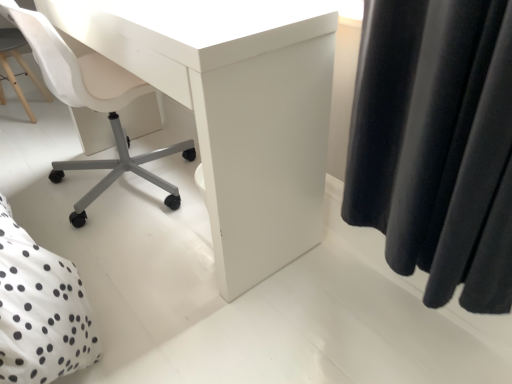
Question: Should I look upward or downward to see white plastic chair at lower left?

Choices:
 (A) up
 (B) down

Answer: (A)

Question: Should I look upward or downward to see white matte desk at center?

Choices:
 (A) down
 (B) up

Answer: (B)

Question: Can you confirm if white plastic chair at lower left is wider than white dotted fabric at lower left?

Choices:
 (A) yes
 (B) no

Answer: (B)

Question: Is white plastic chair at lower left behind white dotted fabric at lower left?

Choices:
 (A) yes
 (B) no

Answer: (A)

Question: From the image's perspective, is white plastic chair at lower left under white dotted fabric at lower left?

Choices:
 (A) yes
 (B) no

Answer: (B)

Question: From a real-world perspective, is white plastic chair at lower left beneath white dotted fabric at lower left?

Choices:
 (A) yes
 (B) no

Answer: (A)

Question: Does white plastic chair at lower left have a lesser height compared to white dotted fabric at lower left?

Choices:
 (A) no
 (B) yes

Answer: (B)

Question: Would you say white plastic chair at lower left is outside white dotted fabric at lower left?

Choices:
 (A) no
 (B) yes

Answer: (B)

Question: Is white matte desk at center shorter than white plastic chair at lower left?

Choices:
 (A) yes
 (B) no

Answer: (A)

Question: Is white matte desk at center to the right of white plastic chair at lower left from the viewer's perspective?

Choices:
 (A) no
 (B) yes

Answer: (B)

Question: Could you tell me if white matte desk at center is turned towards white plastic chair at lower left?

Choices:
 (A) no
 (B) yes

Answer: (B)

Question: From a real-world perspective, is white matte desk at center positioned under white plastic chair at lower left based on gravity?

Choices:
 (A) yes
 (B) no

Answer: (B)

Question: From the image's perspective, is white matte desk at center above white plastic chair at lower left?

Choices:
 (A) no
 (B) yes

Answer: (A)

Question: Is white matte desk at center in front of white plastic chair at lower left?

Choices:
 (A) yes
 (B) no

Answer: (A)

Question: Is white dotted fabric at lower left aimed at white plastic chair at lower left?

Choices:
 (A) yes
 (B) no

Answer: (B)